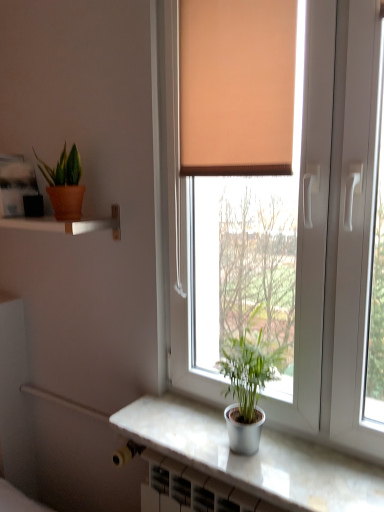
Question: From a real-world perspective, is matte white shelf at upper left on top of silver metallic pot at window, which is counted as the 1th houseplant, starting from the right?

Choices:
 (A) no
 (B) yes

Answer: (B)

Question: Is matte white shelf at upper left bigger than silver metallic pot at window, the 2th houseplant when ordered from back to front?

Choices:
 (A) no
 (B) yes

Answer: (B)

Question: Does matte white shelf at upper left have a greater width compared to silver metallic pot at window, which is counted as the first houseplant, starting from the bottom?

Choices:
 (A) no
 (B) yes

Answer: (B)

Question: Considering the relative sizes of matte white shelf at upper left and silver metallic pot at window, which is the second houseplant in top-to-bottom order, in the image provided, is matte white shelf at upper left thinner than silver metallic pot at window, which is the second houseplant in top-to-bottom order,?

Choices:
 (A) no
 (B) yes

Answer: (A)

Question: Is matte white shelf at upper left shorter than silver metallic pot at window, which is the second houseplant in top-to-bottom order?

Choices:
 (A) no
 (B) yes

Answer: (B)

Question: In terms of height, does white plastic window at center look taller or shorter compared to orange fabric curtain at upper center?

Choices:
 (A) tall
 (B) short

Answer: (A)

Question: In terms of width, does white plastic window at center look wider or thinner when compared to orange fabric curtain at upper center?

Choices:
 (A) thin
 (B) wide

Answer: (B)

Question: In terms of size, does white plastic window at center appear bigger or smaller than orange fabric curtain at upper center?

Choices:
 (A) big
 (B) small

Answer: (A)

Question: Considering their positions, is white plastic window at center located in front of or behind orange fabric curtain at upper center?

Choices:
 (A) front
 (B) behind

Answer: (A)

Question: From the image's perspective, is silver metallic pot at window, which is counted as the 2th houseplant, starting from the left, positioned above or below white plastic window at center?

Choices:
 (A) above
 (B) below

Answer: (B)

Question: Is point pos(240,434) positioned closer to the camera than point pos(372,109)?

Choices:
 (A) closer
 (B) farther

Answer: (B)

Question: Visually, is silver metallic pot at window, which is counted as the 1th houseplant, starting from the right, positioned to the left or to the right of white plastic window at center?

Choices:
 (A) left
 (B) right

Answer: (A)

Question: Considering the positions of silver metallic pot at window, which is counted as the 1th houseplant, starting from the front, and white plastic window at center in the image, is silver metallic pot at window, which is counted as the 1th houseplant, starting from the front, wider or thinner than white plastic window at center?

Choices:
 (A) thin
 (B) wide

Answer: (B)

Question: From the image's perspective, is orange fabric curtain at upper center above or below white plastic window at center?

Choices:
 (A) above
 (B) below

Answer: (A)

Question: Relative to white plastic window at center, is orange fabric curtain at upper center in front or behind?

Choices:
 (A) front
 (B) behind

Answer: (B)